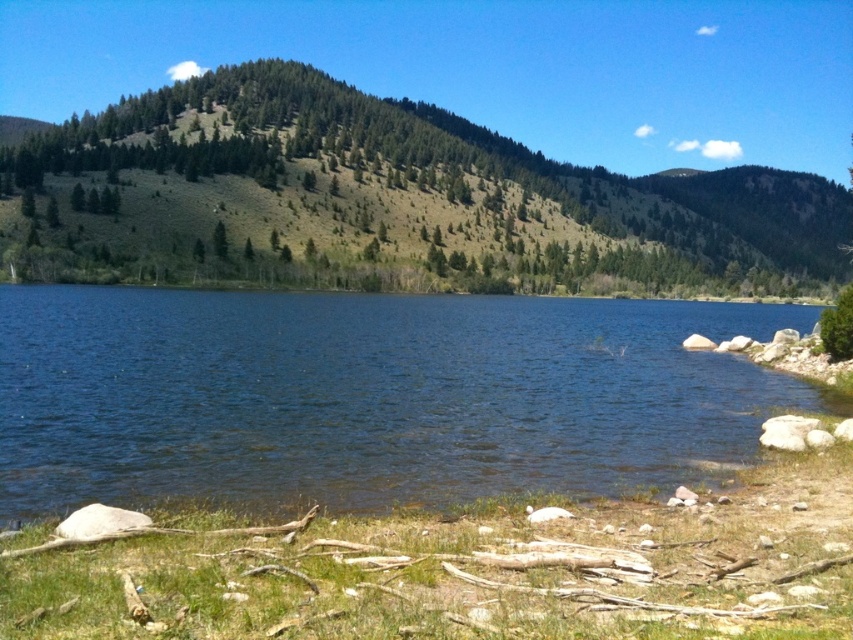
Question: Which of the following is the closest to the observer?

Choices:
 (A) (660, 321)
 (B) (61, 132)

Answer: (A)

Question: Does blue water at center appear over green textured hillside at center?

Choices:
 (A) yes
 (B) no

Answer: (B)

Question: Is blue water at center to the left of green textured hillside at center from the viewer's perspective?

Choices:
 (A) yes
 (B) no

Answer: (A)

Question: Which of the following is the closest to the observer?

Choices:
 (A) (756, 196)
 (B) (279, 314)

Answer: (B)

Question: Is blue water at center thinner than green textured hillside at center?

Choices:
 (A) yes
 (B) no

Answer: (A)